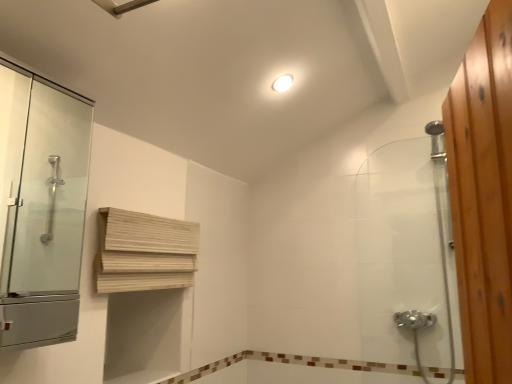
The height and width of the screenshot is (384, 512). In order to click on light wood/wooden shelf at upper center in this screenshot , I will do `click(144, 252)`.

Find the location of a particular element. This screenshot has height=384, width=512. clear glass shower door at right is located at coordinates (407, 258).

The width and height of the screenshot is (512, 384). What do you see at coordinates (282, 83) in the screenshot?
I see `white glossy light fixture at upper center` at bounding box center [282, 83].

Locate an element on the screen. Image resolution: width=512 pixels, height=384 pixels. light wood/wooden shelf at upper center is located at coordinates coord(144,252).

Can you confirm if transparent glass shower door at left is positioned to the right of light wood/wooden shelf at upper center?

No, transparent glass shower door at left is not to the right of light wood/wooden shelf at upper center.

Is transparent glass shower door at left aimed at light wood/wooden shelf at upper center?

No, transparent glass shower door at left is not turned towards light wood/wooden shelf at upper center.

What's the angular difference between transparent glass shower door at left and light wood/wooden shelf at upper center's facing directions?

The facing directions of transparent glass shower door at left and light wood/wooden shelf at upper center are 6.17 degrees apart.

From the image's perspective, is brown mosaic tile at lower center positioned above or below transparent glass shower door at left?

From the image's perspective, brown mosaic tile at lower center appears below transparent glass shower door at left.

Choose the correct answer: Is brown mosaic tile at lower center inside transparent glass shower door at left or outside it?

brown mosaic tile at lower center is outside transparent glass shower door at left.

Which is more to the right, brown mosaic tile at lower center or transparent glass shower door at left?

Positioned to the right is brown mosaic tile at lower center.

How many degrees apart are the facing directions of brown mosaic tile at lower center and transparent glass shower door at left?

90.5 degrees separate the facing orientations of brown mosaic tile at lower center and transparent glass shower door at left.

Considering the relative positions of transparent glass shower door at left and brown mosaic tile at lower center in the image provided, is transparent glass shower door at left to the left of brown mosaic tile at lower center from the viewer's perspective?

Indeed, transparent glass shower door at left is positioned on the left side of brown mosaic tile at lower center.

Consider the image. Does transparent glass shower door at left turn towards brown mosaic tile at lower center?

No, transparent glass shower door at left is not aimed at brown mosaic tile at lower center.

Is transparent glass shower door at left closer to the viewer compared to brown mosaic tile at lower center?

Yes, it is in front of brown mosaic tile at lower center.

Considering the relative sizes of transparent glass shower door at left and brown mosaic tile at lower center in the image provided, is transparent glass shower door at left taller than brown mosaic tile at lower center?

Yes, transparent glass shower door at left is taller than brown mosaic tile at lower center.

Considering the sizes of light wood/wooden shelf at upper center and clear glass shower door at right in the image, is light wood/wooden shelf at upper center taller or shorter than clear glass shower door at right?

light wood/wooden shelf at upper center is shorter than clear glass shower door at right.

From a real-world perspective, which is physically above, light wood/wooden shelf at upper center or clear glass shower door at right?

clear glass shower door at right is physically above.

Considering the sizes of objects light wood/wooden shelf at upper center and clear glass shower door at right in the image provided, who is thinner, light wood/wooden shelf at upper center or clear glass shower door at right?

Thinner between the two is light wood/wooden shelf at upper center.

Consider the image. Is clear glass shower door at right next to transparent glass shower door at left?

No, clear glass shower door at right is not beside transparent glass shower door at left.

Which object is further away from the camera, clear glass shower door at right or transparent glass shower door at left?

clear glass shower door at right is more distant.

Considering the points (431, 155) and (44, 254), which point is in front, point (431, 155) or point (44, 254)?

Positioned in front is point (431, 155).

Considering the sizes of objects clear glass shower door at right and transparent glass shower door at left in the image provided, who is smaller, clear glass shower door at right or transparent glass shower door at left?

transparent glass shower door at left is smaller.

Looking at this image, considering the sizes of light wood/wooden shelf at upper center and white glossy light fixture at upper center in the image, is light wood/wooden shelf at upper center wider or thinner than white glossy light fixture at upper center?

In the image, light wood/wooden shelf at upper center appears to be more narrow than white glossy light fixture at upper center.

In the scene shown: Could you tell me if light wood/wooden shelf at upper center is turned towards white glossy light fixture at upper center?

No, light wood/wooden shelf at upper center is not facing towards white glossy light fixture at upper center.

Based on the photo, is white glossy light fixture at upper center inside light wood/wooden shelf at upper center?

No, white glossy light fixture at upper center is not inside light wood/wooden shelf at upper center.

Does white glossy light fixture at upper center turn towards transparent glass shower door at left?

No, white glossy light fixture at upper center is not facing towards transparent glass shower door at left.

From a real-world perspective, who is located higher, white glossy light fixture at upper center or transparent glass shower door at left?

white glossy light fixture at upper center.

Is white glossy light fixture at upper center positioned beyond the bounds of transparent glass shower door at left?

white glossy light fixture at upper center lies outside transparent glass shower door at left's area.

Can you confirm if white glossy light fixture at upper center is wider than transparent glass shower door at left?

No.

Image resolution: width=512 pixels, height=384 pixels. Identify the location of shelf that is on the right side of transparent glass shower door at left. (144, 252).

At what (x,y) coordinates should I click in order to perform the action: click on bath that appears behind the transparent glass shower door at left. Please return your answer as a coordinate pair (x, y). Looking at the image, I should click on (311, 366).

Consider the image. Based on their spatial positions, is white glossy light fixture at upper center or brown mosaic tile at lower center closer to clear glass shower door at right?

brown mosaic tile at lower center lies closer to clear glass shower door at right than the other object.

Estimate the real-world distances between objects in this image. Which object is further from clear glass shower door at right, light wood/wooden shelf at upper center or transparent glass shower door at left?

transparent glass shower door at left is further to clear glass shower door at right.

Looking at the image, which one is located further to brown mosaic tile at lower center, white glossy light fixture at upper center or transparent glass shower door at left?

Based on the image, transparent glass shower door at left appears to be further to brown mosaic tile at lower center.

Looking at the image, which one is located further to white glossy light fixture at upper center, clear glass shower door at right or transparent glass shower door at left?

transparent glass shower door at left.

Based on their spatial positions, is clear glass shower door at right or transparent glass shower door at left further from light wood/wooden shelf at upper center?

transparent glass shower door at left lies further to light wood/wooden shelf at upper center than the other object.

Which object lies further to the anchor point light wood/wooden shelf at upper center, white glossy light fixture at upper center or transparent glass shower door at left?

transparent glass shower door at left is positioned further to the anchor light wood/wooden shelf at upper center.

When comparing their distances from light wood/wooden shelf at upper center, does brown mosaic tile at lower center or transparent glass shower door at left seem closer?

brown mosaic tile at lower center is positioned closer to the anchor light wood/wooden shelf at upper center.

Estimate the real-world distances between objects in this image. Which object is further from light wood/wooden shelf at upper center, transparent glass shower door at left or brown mosaic tile at lower center?

transparent glass shower door at left is further to light wood/wooden shelf at upper center.

This screenshot has height=384, width=512. I want to click on bath between light wood/wooden shelf at upper center and clear glass shower door at right from left to right, so click(x=311, y=366).

The height and width of the screenshot is (384, 512). In order to click on shelf between transparent glass shower door at left and white glossy light fixture at upper center along the z-axis in this screenshot , I will do `click(144, 252)`.

You are a GUI agent. You are given a task and a screenshot of the screen. Output one action in this format:
    pyautogui.click(x=<x>, y=<y>)
    Task: Click on the shower door between white glossy light fixture at upper center and brown mosaic tile at lower center vertically
    
    Given the screenshot: What is the action you would take?
    pyautogui.click(x=407, y=258)

Locate an element on the screen. The image size is (512, 384). light fixture between transparent glass shower door at left and clear glass shower door at right from left to right is located at coordinates (282, 83).